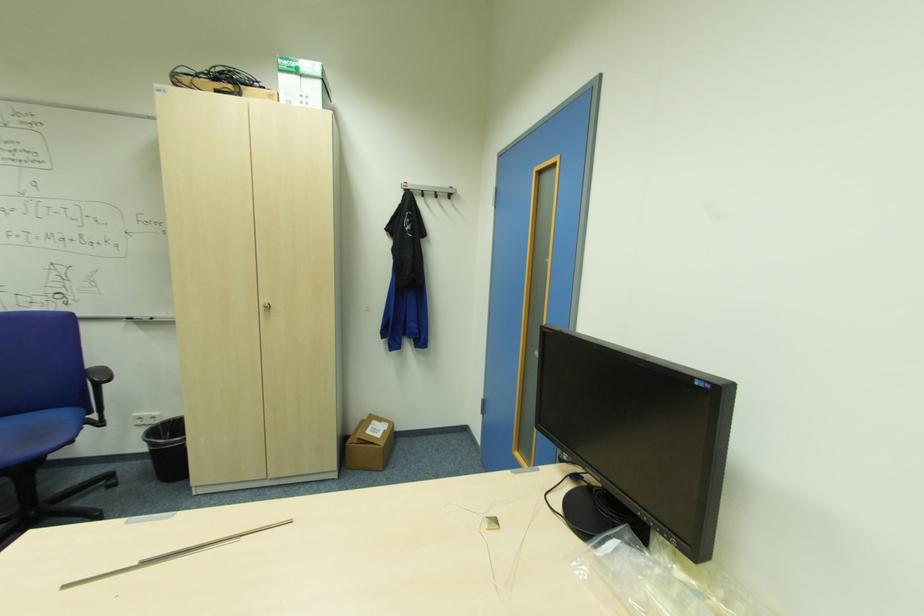
The location [301,83] corresponds to which object?

This point indicates the white and green box.